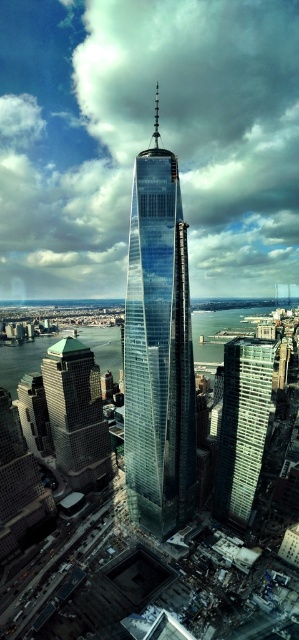
Is point (145, 492) positioned after point (92, 356)?

No, (145, 492) is in front of (92, 356).

Can you confirm if transparent glass skyscraper at center is positioned below green glass building at lower left?

No, transparent glass skyscraper at center is not below green glass building at lower left.

Is point (162, 291) less distant than point (98, 429)?

Yes, point (162, 291) is closer to viewer.

Where is `transparent glass skyscraper at center`? Image resolution: width=299 pixels, height=640 pixels. transparent glass skyscraper at center is located at coordinates (157, 349).

Which is more to the right, transparent glass skyscraper at center or glassy steel skyscraper at center?

Positioned to the right is glassy steel skyscraper at center.

Which is below, transparent glass skyscraper at center or glassy steel skyscraper at center?

glassy steel skyscraper at center

What do you see at coordinates (157, 349) in the screenshot?
I see `transparent glass skyscraper at center` at bounding box center [157, 349].

Where is `transparent glass skyscraper at center`? This screenshot has width=299, height=640. transparent glass skyscraper at center is located at coordinates (157, 349).

Which is below, glassy steel skyscraper at center or green glass building at lower left?

Positioned lower is green glass building at lower left.

Can you confirm if glassy steel skyscraper at center is smaller than green glass building at lower left?

Correct, glassy steel skyscraper at center occupies less space than green glass building at lower left.

What do you see at coordinates (243, 426) in the screenshot? I see `glassy steel skyscraper at center` at bounding box center [243, 426].

The image size is (299, 640). I want to click on glassy steel skyscraper at center, so click(243, 426).